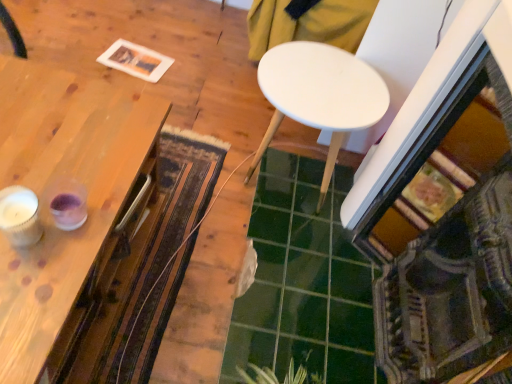
Question: From the image's perspective, is white textured candle at left located above or below white matte table at center, which appears as the 1th table when viewed from the right?

Choices:
 (A) below
 (B) above

Answer: (A)

Question: From a real-world perspective, is white textured candle at left positioned above or below white matte table at center, which appears as the 1th table when viewed from the right?

Choices:
 (A) above
 (B) below

Answer: (A)

Question: Which object is the closest to the green leafy plant at lower center?

Choices:
 (A) white matte table at center, which appears as the 1th table when viewed from the right
 (B) textured woolen mat at center
 (C) green glossy tile at center
 (D) white textured candle at left
 (E) wooden table at left, the second table viewed from the right

Answer: (C)

Question: Which is nearer to the green glossy tile at center?

Choices:
 (A) wooden table at left, marked as the first table in a left-to-right arrangement
 (B) green leafy plant at lower center
 (C) textured woolen mat at center
 (D) white textured candle at left
 (E) white matte table at center, marked as the 2th table in a left-to-right arrangement

Answer: (B)